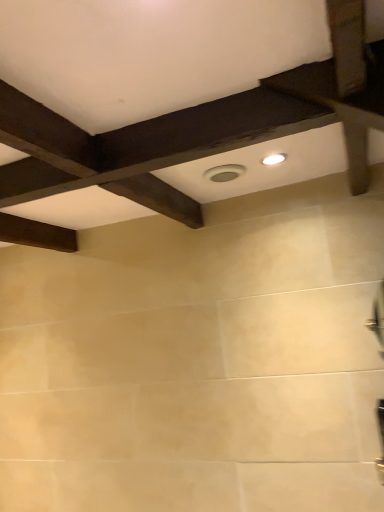
This screenshot has width=384, height=512. What do you see at coordinates (151, 52) in the screenshot? I see `dark wood bed frame at upper center` at bounding box center [151, 52].

Locate an element on the screen. dark wood bed frame at upper center is located at coordinates (151, 52).

Locate an element on the screen. The height and width of the screenshot is (512, 384). dark wood bed frame at upper center is located at coordinates (151, 52).